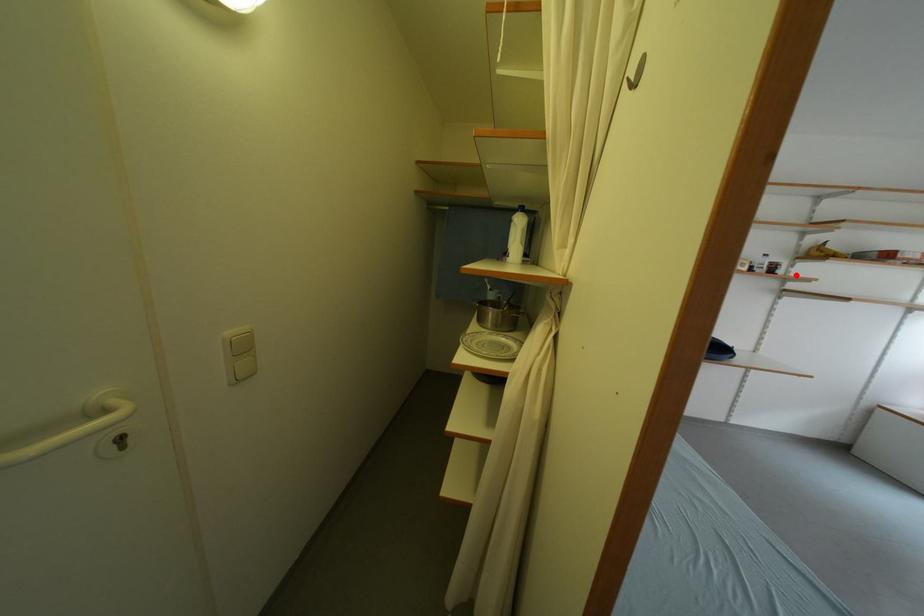
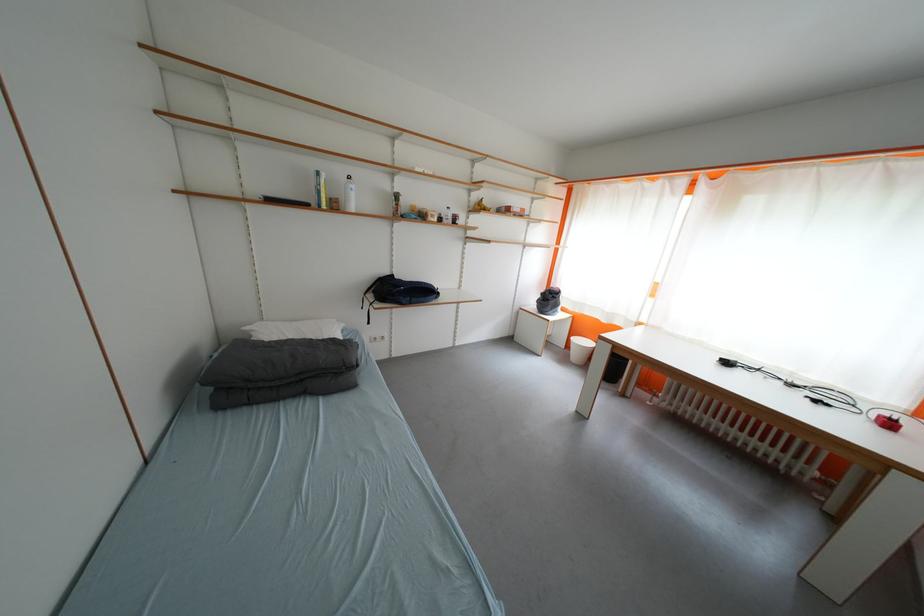
Find the pixel in the second image that matches the highlighted location in the first image.

(476, 225)